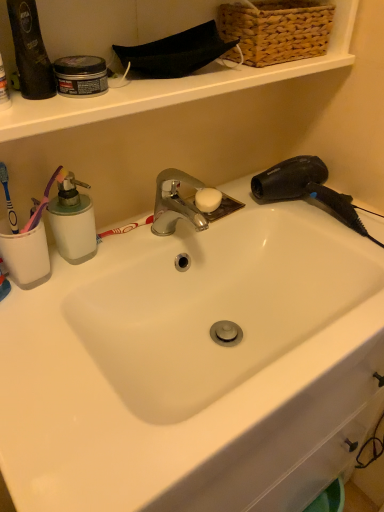
Where is `free space to the right of white plastic soap dispenser at left`? free space to the right of white plastic soap dispenser at left is located at coordinates (137, 249).